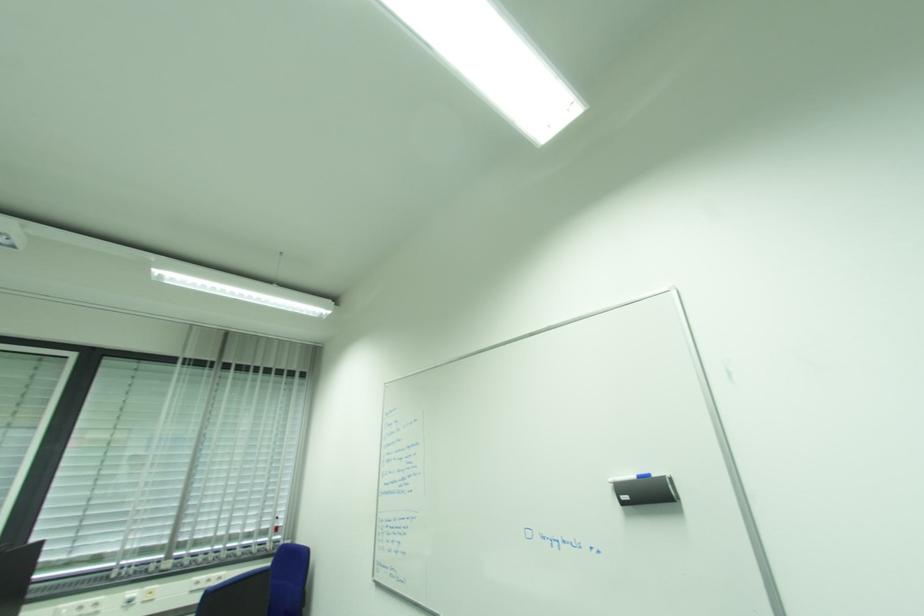
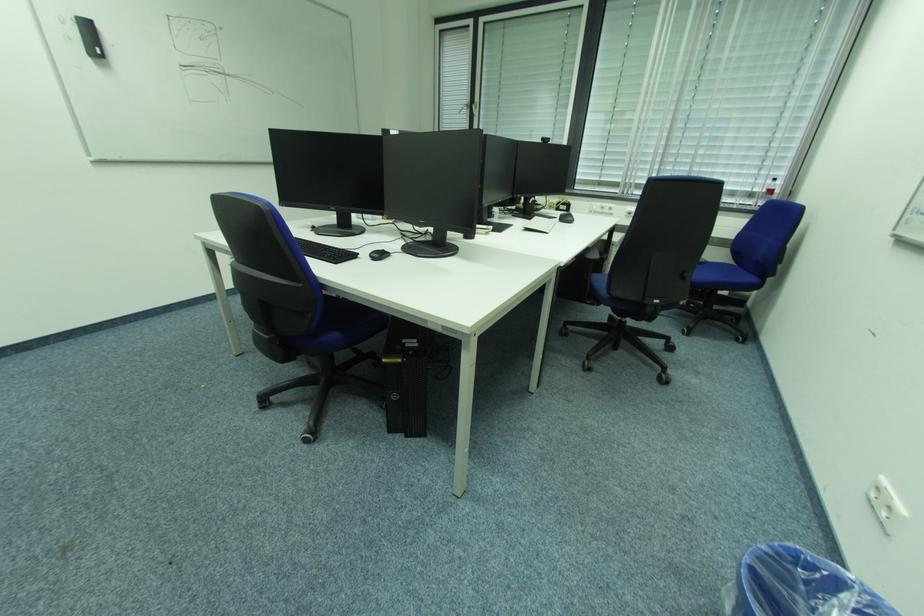
First-person continuous shooting, in which direction is the camera rotating?

The camera rotated toward left-down.